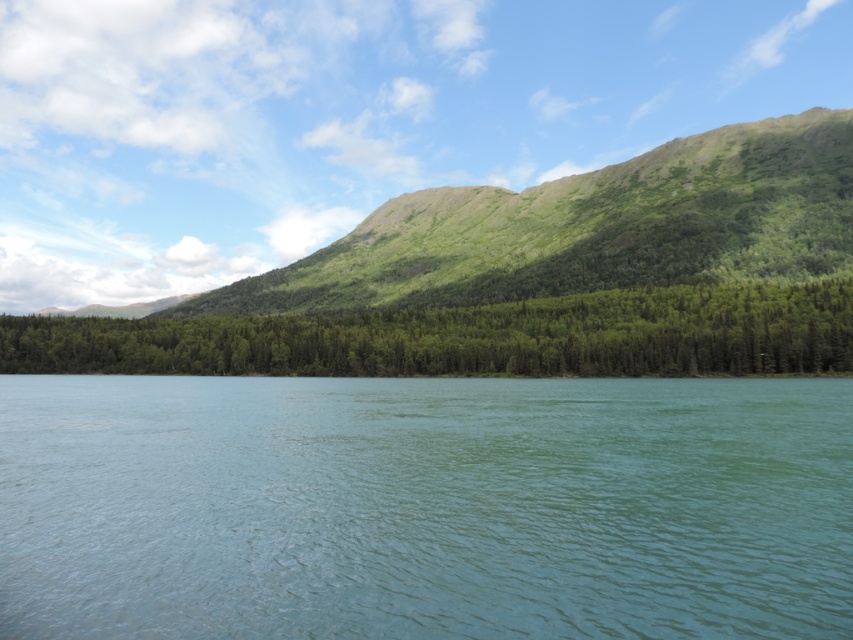
Question: Can you confirm if green smooth water at center is wider than green matte forest at center?

Choices:
 (A) no
 (B) yes

Answer: (A)

Question: Considering the relative positions of green smooth water at center and green matte forest at center in the image provided, where is green smooth water at center located with respect to green matte forest at center?

Choices:
 (A) left
 (B) right

Answer: (B)

Question: Can you confirm if green smooth water at center is positioned below green matte forest at center?

Choices:
 (A) yes
 (B) no

Answer: (A)

Question: Which point appears farthest from the camera in this image?

Choices:
 (A) (840, 516)
 (B) (635, 316)

Answer: (B)

Question: Which point appears closest to the camera in this image?

Choices:
 (A) click(x=665, y=474)
 (B) click(x=689, y=310)

Answer: (A)